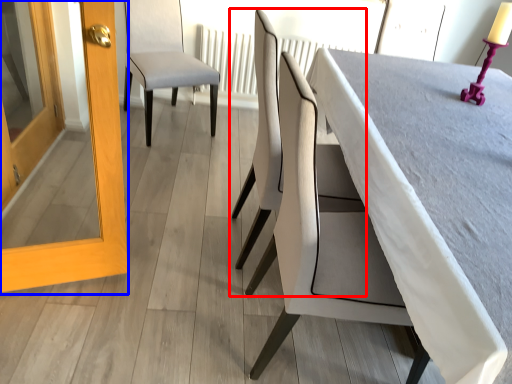
Question: Which object appears farthest to the camera in this image, chair (highlighted by a red box) or screen door (highlighted by a blue box)?

Choices:
 (A) chair
 (B) screen door

Answer: (A)